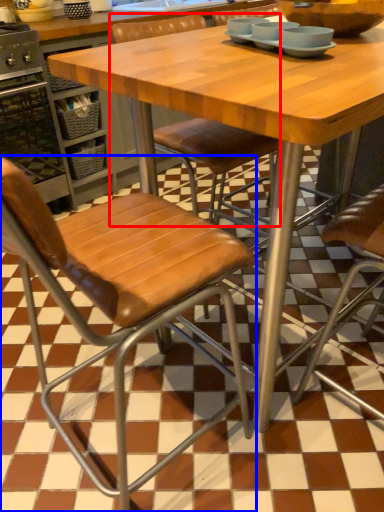
Question: Which of the following is the farthest to the observer, chair (highlighted by a red box) or chair (highlighted by a blue box)?

Choices:
 (A) chair
 (B) chair

Answer: (A)